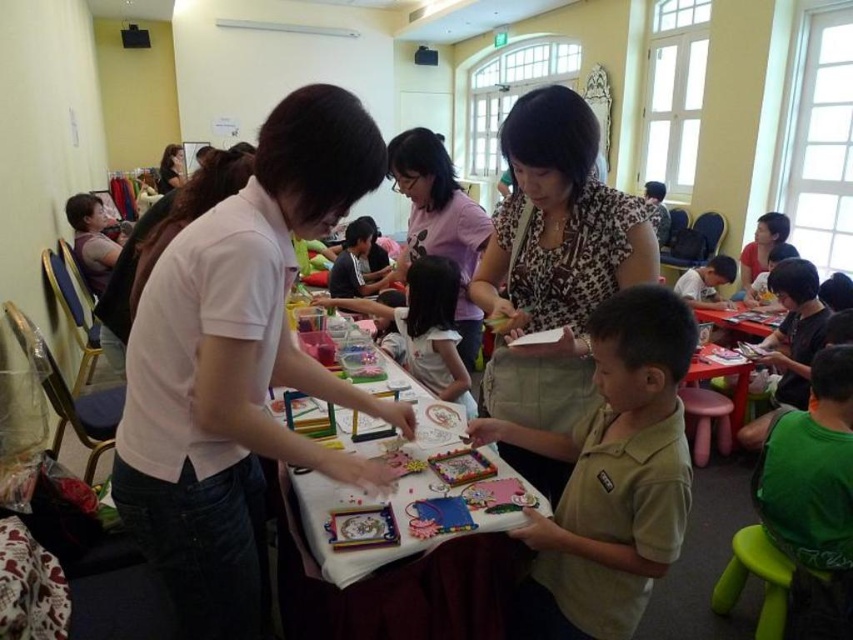
Question: Which is farther from the white matte shirt at center?

Choices:
 (A) light brown cotton shirt at center
 (B) printed fabric shirt at center
 (C) light pink fabric at center
 (D) white paper at center

Answer: (C)

Question: Observing the image, what is the correct spatial positioning of printed fabric shirt at center in reference to white paper at center?

Choices:
 (A) above
 (B) below

Answer: (A)

Question: Does white matte shirt at center have a smaller size compared to printed fabric shirt at center?

Choices:
 (A) yes
 (B) no

Answer: (B)

Question: Which of these objects is positioned closest to the light brown cotton shirt at center?

Choices:
 (A) printed fabric shirt at center
 (B) white matte shirt at center
 (C) white paper at center

Answer: (A)

Question: Is light pink fabric at center further to the viewer compared to green plastic stool at lower right?

Choices:
 (A) no
 (B) yes

Answer: (B)

Question: Which is nearer to the white paper at center?

Choices:
 (A) white matte shirt at center
 (B) light brown cotton shirt at center

Answer: (A)